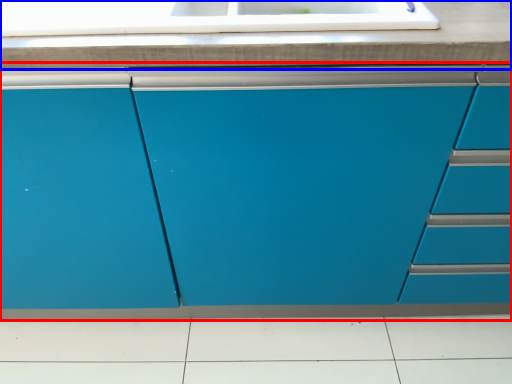
Question: Which object is further to the camera taking this photo, cabinetry (highlighted by a red box) or countertop (highlighted by a blue box)?

Choices:
 (A) cabinetry
 (B) countertop

Answer: (B)